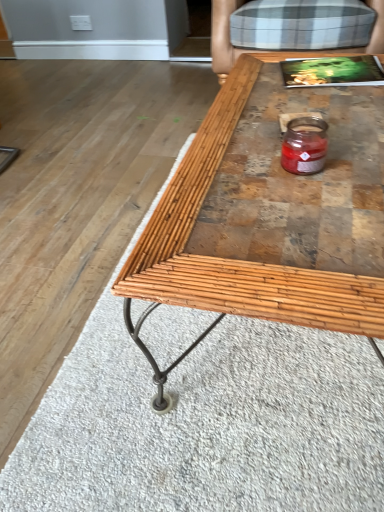
Image resolution: width=384 pixels, height=512 pixels. What are the coordinates of `vacant space that is to the left of translucent glass candle at center` in the screenshot? It's located at (241, 175).